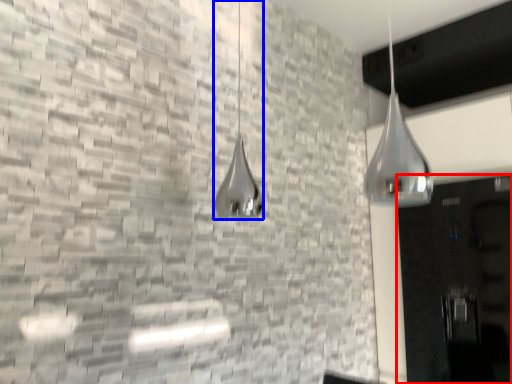
Question: Which of the following is the closest to the observer, door (highlighted by a red box) or shower (highlighted by a blue box)?

Choices:
 (A) door
 (B) shower

Answer: (B)